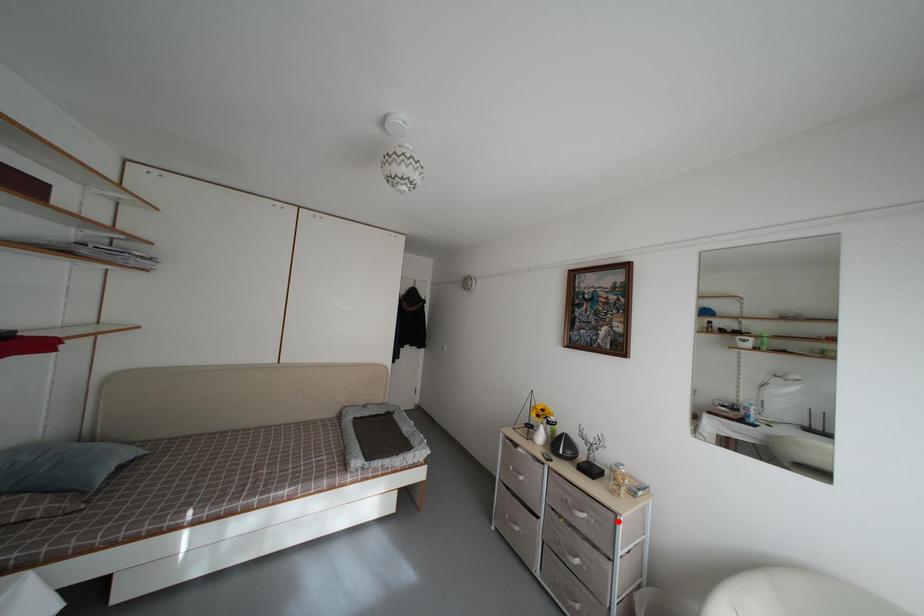
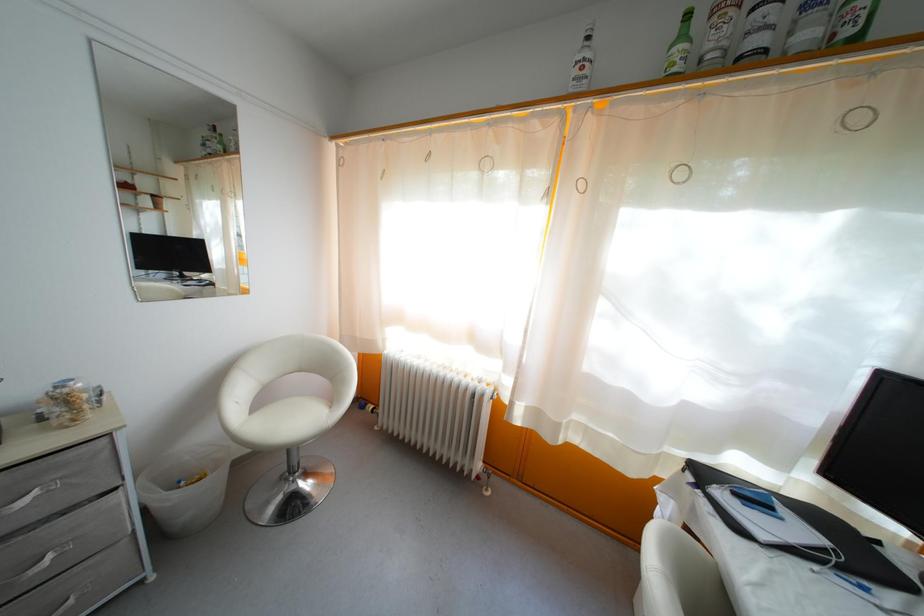
Question: I am providing you with two images of the same scene from different viewpoints. Given a red point in image1, look at the same physical point in image2. Is it:

Choices:
 (A) Closer to the viewpoint
 (B) Farther from the viewpoint

Answer: (A)